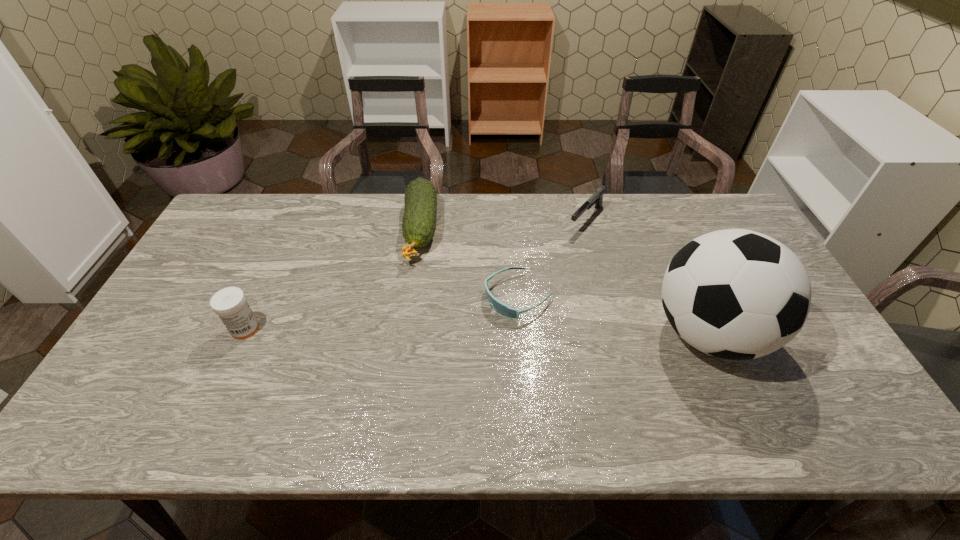
Locate an element on the screen. This screenshot has height=540, width=960. empty location between the second object from left to right and the medicine is located at coordinates (333, 280).

Identify the location of free space between the tallest object and the third shortest object. Image resolution: width=960 pixels, height=540 pixels. (564, 281).

Where is `vacant space that is in between the fourth object from left to right and the medicine`? The width and height of the screenshot is (960, 540). vacant space that is in between the fourth object from left to right and the medicine is located at coordinates (416, 274).

This screenshot has width=960, height=540. In order to click on vacant area between the goggles and the medicine in this screenshot , I will do `click(382, 313)`.

Identify the location of vacant area between the third tallest object and the tallest object. This screenshot has width=960, height=540. (564, 281).

The width and height of the screenshot is (960, 540). In order to click on vacant area that lies between the third shortest object and the rightmost object in this screenshot , I will do `click(564, 281)`.

Where is `vacant region between the gun and the third object from left to right`? vacant region between the gun and the third object from left to right is located at coordinates (552, 258).

Locate an element on the screen. vacant area that lies between the second object from right to left and the soccer ball is located at coordinates (647, 276).

Identify the location of empty location between the leftmost object and the third object from left to right. This screenshot has height=540, width=960. (382, 313).

The image size is (960, 540). Find the location of `object that is the third closest to the gun`. object that is the third closest to the gun is located at coordinates (419, 222).